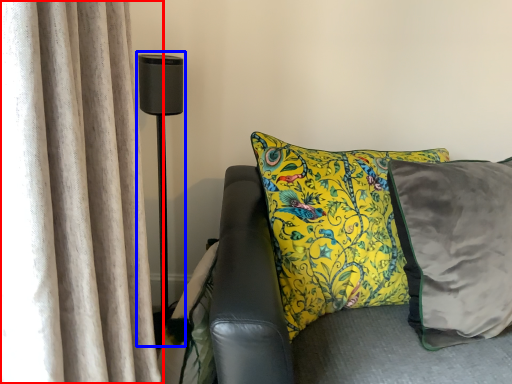
Question: Which of the following is the farthest to the observer, curtain (highlighted by a red box) or table lamp (highlighted by a blue box)?

Choices:
 (A) curtain
 (B) table lamp

Answer: (B)